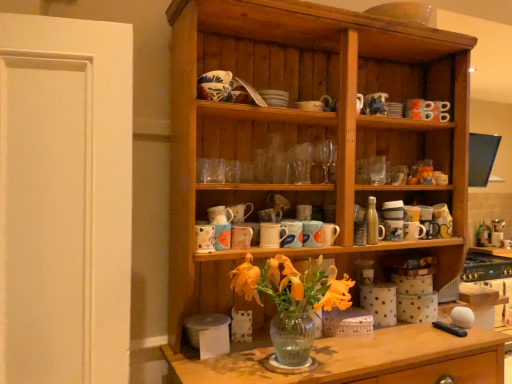
Question: Can you confirm if blue and white ceramic mug at center, the fourth tableware in the top-to-bottom sequence, is smaller than matte ceramic mug at center, the eighth tableware from the right?

Choices:
 (A) yes
 (B) no

Answer: (B)

Question: Can you confirm if blue and white ceramic mug at center, which appears as the 5th tableware when viewed from the left, is wider than matte ceramic mug at center, marked as the first tableware in a left-to-right arrangement?

Choices:
 (A) no
 (B) yes

Answer: (B)

Question: Is the depth of blue and white ceramic mug at center, which appears as the 5th tableware when viewed from the left, less than that of matte ceramic mug at center, which appears as the 3th tableware when ordered from the bottom?

Choices:
 (A) yes
 (B) no

Answer: (B)

Question: Is blue and white ceramic mug at center, the fourth tableware in the top-to-bottom sequence, taller than matte ceramic mug at center, which appears as the 3th tableware when ordered from the bottom?

Choices:
 (A) no
 (B) yes

Answer: (B)

Question: From a real-world perspective, is blue and white ceramic mug at center, which appears as the 5th tableware when viewed from the left, on top of matte ceramic mug at center, marked as the first tableware in a left-to-right arrangement?

Choices:
 (A) yes
 (B) no

Answer: (A)

Question: In the image, is matte ceramic mug at center, which appears as the 3th tableware when ordered from the bottom, on the left side or the right side of white matte door at left?

Choices:
 (A) left
 (B) right

Answer: (B)

Question: Does point (212, 241) appear closer or farther from the camera than point (84, 99)?

Choices:
 (A) closer
 (B) farther

Answer: (B)

Question: From their relative heights in the image, would you say matte ceramic mug at center, which appears as the 3th tableware when ordered from the bottom, is taller or shorter than white matte door at left?

Choices:
 (A) short
 (B) tall

Answer: (A)

Question: From a real-world perspective, is matte ceramic mug at center, which is the sixth tableware from top to bottom, physically located above or below white matte door at left?

Choices:
 (A) below
 (B) above

Answer: (A)

Question: From the image's perspective, relative to blue and white ceramic mug at center, which is the 5th tableware from bottom to top, is white matte door at left above or below?

Choices:
 (A) above
 (B) below

Answer: (A)

Question: Looking at their shapes, would you say white matte door at left is wider or thinner than blue and white ceramic mug at center, which appears as the 5th tableware when viewed from the left?

Choices:
 (A) thin
 (B) wide

Answer: (B)

Question: Is white matte door at left in front of or behind blue and white ceramic mug at center, the 4th tableware positioned from the right, in the image?

Choices:
 (A) front
 (B) behind

Answer: (A)

Question: Is white matte door at left taller or shorter than blue and white ceramic mug at center, the 4th tableware positioned from the right?

Choices:
 (A) tall
 (B) short

Answer: (A)

Question: Considering the relative positions of blue and white ceramic mug at center, which is the 5th tableware from bottom to top, and white matte door at left in the image provided, is blue and white ceramic mug at center, which is the 5th tableware from bottom to top, to the left or to the right of white matte door at left?

Choices:
 (A) left
 (B) right

Answer: (B)

Question: From their relative heights in the image, would you say blue and white ceramic mug at center, which appears as the 5th tableware when viewed from the left, is taller or shorter than white matte door at left?

Choices:
 (A) tall
 (B) short

Answer: (B)